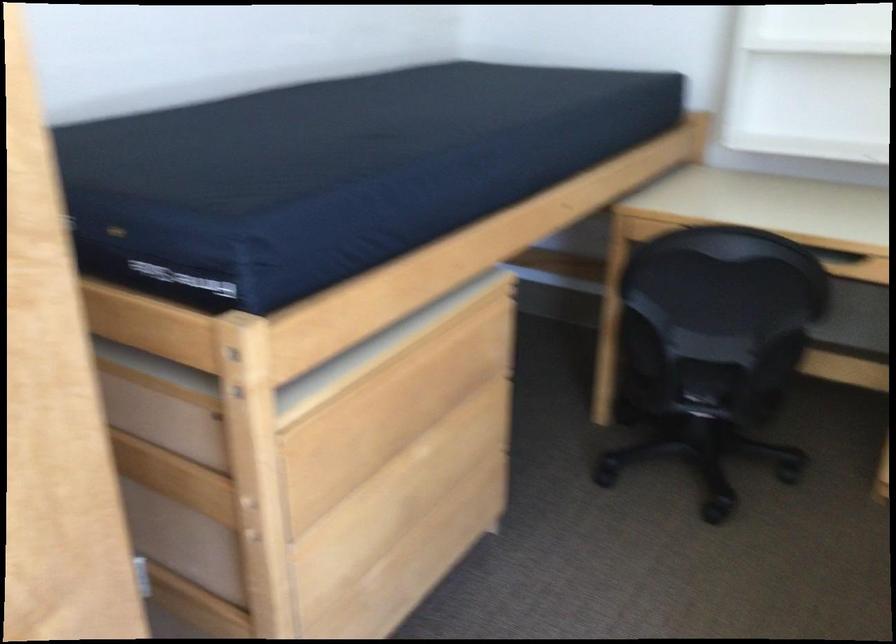
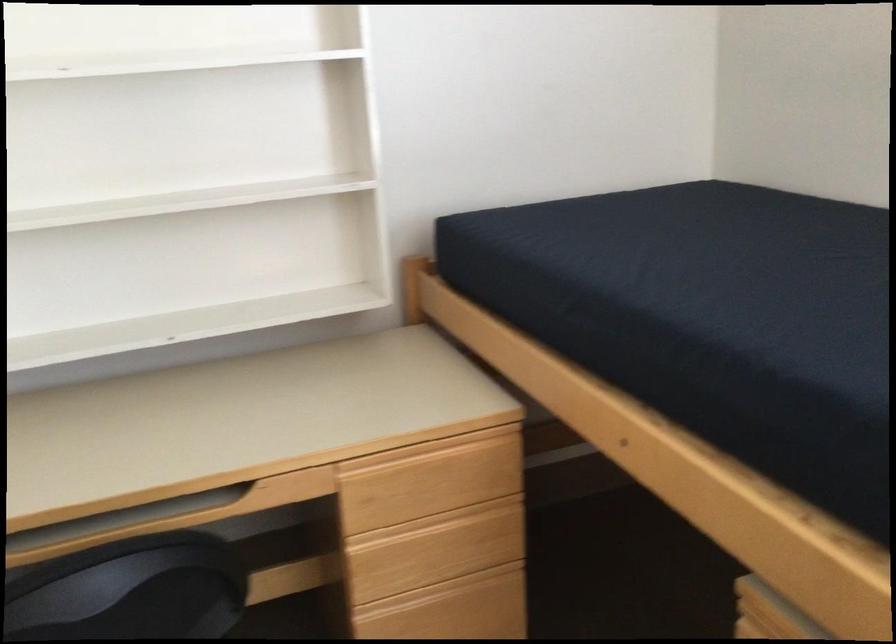
Question: How did the camera likely rotate?

Choices:
 (A) Left
 (B) Right
 (C) Up
 (D) Down

Answer: (B)